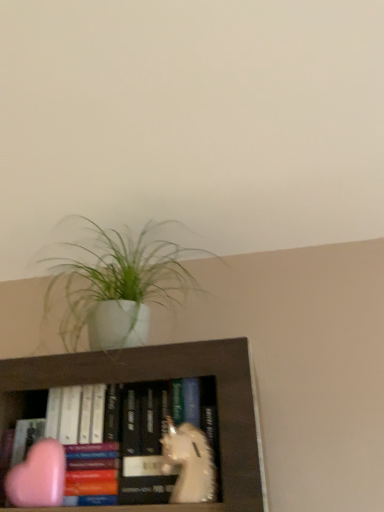
Question: Can you confirm if white matte pot at upper center is taller than pink matte heart at lower left, positioned as the 1th animal in left-to-right order?

Choices:
 (A) yes
 (B) no

Answer: (A)

Question: Can you confirm if white matte pot at upper center is positioned to the right of pink matte heart at lower left, which is the second animal from right to left?

Choices:
 (A) no
 (B) yes

Answer: (B)

Question: Does white matte pot at upper center appear on the left side of pink matte heart at lower left, which is the second animal from right to left?

Choices:
 (A) yes
 (B) no

Answer: (B)

Question: Is white matte pot at upper center far from pink matte heart at lower left, positioned as the 1th animal in left-to-right order?

Choices:
 (A) no
 (B) yes

Answer: (A)

Question: Does white matte pot at upper center come behind pink matte heart at lower left, positioned as the 1th animal in left-to-right order?

Choices:
 (A) no
 (B) yes

Answer: (B)

Question: From the image's perspective, is pink matte heart at lower left, which is the second animal from right to left, positioned above or below white matte pot at upper center?

Choices:
 (A) below
 (B) above

Answer: (A)

Question: From a real-world perspective, is pink matte heart at lower left, positioned as the 1th animal in left-to-right order, above or below white matte pot at upper center?

Choices:
 (A) above
 (B) below

Answer: (B)

Question: Considering the positions of point (19, 504) and point (119, 270), is point (19, 504) closer or farther from the camera than point (119, 270)?

Choices:
 (A) farther
 (B) closer

Answer: (B)

Question: In the image, is pink matte heart at lower left, which is the second animal from right to left, positioned in front of or behind white matte pot at upper center?

Choices:
 (A) behind
 (B) front

Answer: (B)

Question: Is pink matte heart at lower left, positioned as the 1th animal in left-to-right order, spatially inside white matte unicorn at center, the second animal viewed from the left, or outside of it?

Choices:
 (A) inside
 (B) outside

Answer: (B)

Question: Considering the positions of pink matte heart at lower left, which is the second animal from right to left, and white matte unicorn at center, placed as the 1th animal when sorted from right to left, in the image, is pink matte heart at lower left, which is the second animal from right to left, bigger or smaller than white matte unicorn at center, placed as the 1th animal when sorted from right to left,?

Choices:
 (A) big
 (B) small

Answer: (B)

Question: From a real-world perspective, is pink matte heart at lower left, which is the second animal from right to left, positioned above or below white matte unicorn at center, the second animal viewed from the left?

Choices:
 (A) below
 (B) above

Answer: (A)

Question: Based on their positions, is pink matte heart at lower left, positioned as the 1th animal in left-to-right order, located to the left or right of white matte unicorn at center, the second animal viewed from the left?

Choices:
 (A) right
 (B) left

Answer: (B)

Question: From a real-world perspective, is white matte unicorn at center, the second animal viewed from the left, positioned above or below pink matte heart at lower left, positioned as the 1th animal in left-to-right order?

Choices:
 (A) above
 (B) below

Answer: (A)

Question: In terms of size, does white matte unicorn at center, placed as the 1th animal when sorted from right to left, appear bigger or smaller than pink matte heart at lower left, positioned as the 1th animal in left-to-right order?

Choices:
 (A) small
 (B) big

Answer: (B)